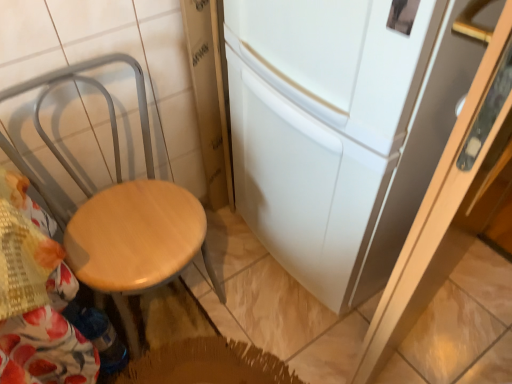
This screenshot has width=512, height=384. I want to click on wooden seat at left, so click(121, 210).

Image resolution: width=512 pixels, height=384 pixels. What do you see at coordinates (121, 210) in the screenshot?
I see `wooden seat at left` at bounding box center [121, 210].

Image resolution: width=512 pixels, height=384 pixels. Find the location of `white matte refrigerator at center`. white matte refrigerator at center is located at coordinates (340, 130).

Measure the distance between point (x=486, y=9) and camera.

A distance of 30.16 inches exists between point (x=486, y=9) and camera.

Describe the element at coordinates (340, 130) in the screenshot. This screenshot has width=512, height=384. I see `white matte refrigerator at center` at that location.

The width and height of the screenshot is (512, 384). In order to click on wooden seat at left in this screenshot , I will do `click(121, 210)`.

Does white matte refrigerator at center appear on the left side of wooden seat at left?

In fact, white matte refrigerator at center is to the right of wooden seat at left.

In the image, is white matte refrigerator at center positioned in front of or behind wooden seat at left?

white matte refrigerator at center is in front of wooden seat at left.

Does point (283, 212) come behind point (108, 221)?

Yes, it is.

From the image's perspective, is white matte refrigerator at center above or below wooden seat at left?

white matte refrigerator at center is above wooden seat at left.

From a real-world perspective, is white matte refrigerator at center below wooden seat at left?

No.

Considering the sizes of objects white matte refrigerator at center and wooden seat at left in the image provided, who is thinner, white matte refrigerator at center or wooden seat at left?

wooden seat at left is thinner.

Is white matte refrigerator at center taller than wooden seat at left?

Yes, white matte refrigerator at center is taller than wooden seat at left.

Who is smaller, white matte refrigerator at center or wooden seat at left?

wooden seat at left is smaller.

Which is correct: white matte refrigerator at center is inside wooden seat at left, or outside of it?

white matte refrigerator at center is not enclosed by wooden seat at left.

Is white matte refrigerator at center touching wooden seat at left?

No, white matte refrigerator at center is not touching wooden seat at left.

Could you tell me if white matte refrigerator at center is turned towards wooden seat at left?

Yes, white matte refrigerator at center faces towards wooden seat at left.

How distant is white matte refrigerator at center from wooden seat at left?

They are 17.24 inches apart.

Identify the location of chair lying on the left of white matte refrigerator at center. The image size is (512, 384). (121, 210).

Which is more to the left, wooden seat at left or white matte refrigerator at center?

Positioned to the left is wooden seat at left.

Considering the positions of objects wooden seat at left and white matte refrigerator at center in the image provided, who is in front, wooden seat at left or white matte refrigerator at center?

white matte refrigerator at center is in front.

Is point (69, 253) closer to camera compared to point (238, 100)?

That is True.

From the image's perspective, is wooden seat at left over white matte refrigerator at center?

Actually, wooden seat at left appears below white matte refrigerator at center in the image.

From a real-world perspective, is wooden seat at left physically located above or below white matte refrigerator at center?

In terms of real-world spatial position, wooden seat at left is below white matte refrigerator at center.

Between wooden seat at left and white matte refrigerator at center, which one has smaller width?

With smaller width is wooden seat at left.

Consider the image. Who is taller, wooden seat at left or white matte refrigerator at center?

With more height is white matte refrigerator at center.

Considering the sizes of objects wooden seat at left and white matte refrigerator at center in the image provided, who is smaller, wooden seat at left or white matte refrigerator at center?

Smaller between the two is wooden seat at left.

Which is correct: wooden seat at left is inside white matte refrigerator at center, or outside of it?

wooden seat at left is spatially situated outside white matte refrigerator at center.

Is wooden seat at left positioned far away from white matte refrigerator at center?

They are positioned close to each other.

Is wooden seat at left positioned with its back to white matte refrigerator at center?

That's not correct — wooden seat at left is not looking away from white matte refrigerator at center.

You are a GUI agent. You are given a task and a screenshot of the screen. Output one action in this format:
    pyautogui.click(x=<x>, y=<y>)
    Task: Click on the fridge lying on the right of wooden seat at left
    
    Given the screenshot: What is the action you would take?
    [x=340, y=130]

I want to click on chair below the white matte refrigerator at center (from a real-world perspective), so click(x=121, y=210).

The image size is (512, 384). I want to click on fridge on the right side of wooden seat at left, so click(x=340, y=130).